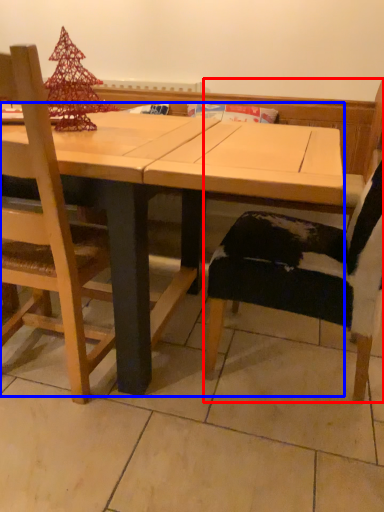
Question: Which of the following is the closest to the observer, chair (highlighted by a red box) or table (highlighted by a blue box)?

Choices:
 (A) chair
 (B) table

Answer: (A)